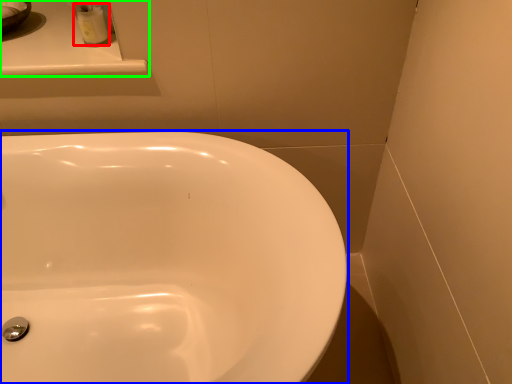
Question: Which is farther away from toiletry (highlighted by a red box)? sink (highlighted by a blue box) or counter top (highlighted by a green box)?

Choices:
 (A) sink
 (B) counter top

Answer: (A)